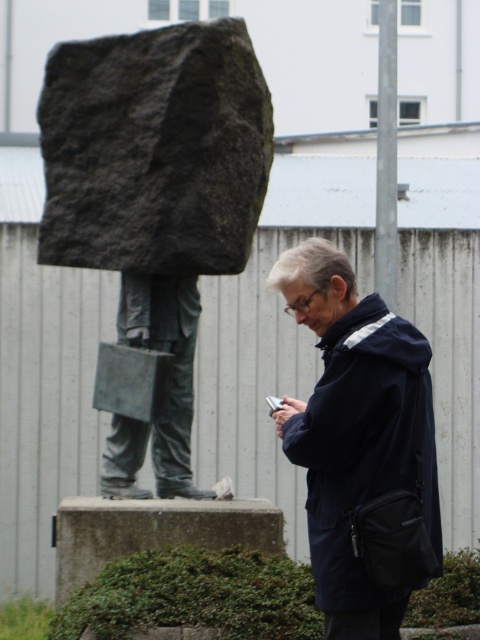
You are a photographer trying to capture a photo of both the dark gray stone statue at center and the navy blue jacket at center in the same frame. Based on their sizes, will the statue appear larger than the person in the photo?

The dark gray stone statue at center is much taller than the navy blue jacket at center, so yes, the statue will appear larger than the person in the photo.

You are a tour guide explaining the statue and the person in the image. Which object is bigger in size between the dark gray stone statue at center and the navy blue jacket at center?

The dark gray stone statue at center is larger in size compared to the navy blue jacket at center.

You are a tour guide explaining the statues in the outdoor scene. You need to inform visitors about the distance between the dark gray stone statue at center and the bronze statue at center. What do you tell them?

The dark gray stone statue at center and the bronze statue at center are 20.36 centimeters apart.